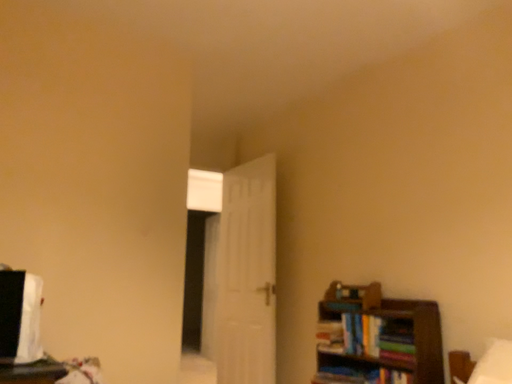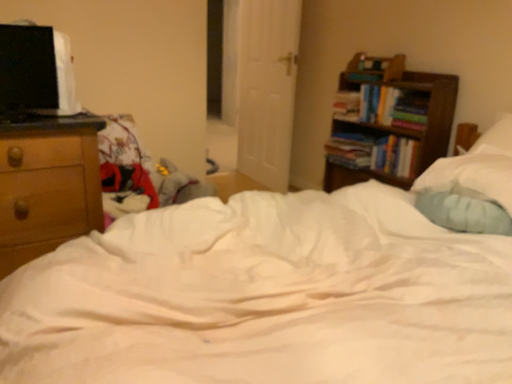
Question: How did the camera likely rotate when shooting the video?

Choices:
 (A) rotated downward
 (B) rotated upward

Answer: (A)